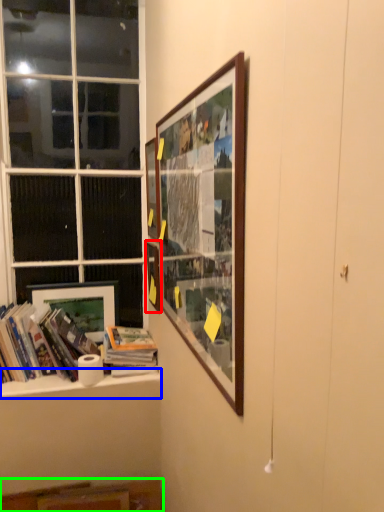
Question: Which is farther away from picture frame (highlighted by a red box)? window sill (highlighted by a blue box) or cabinet (highlighted by a green box)?

Choices:
 (A) window sill
 (B) cabinet

Answer: (B)